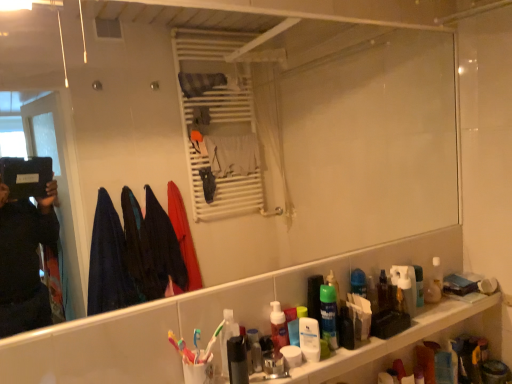
Question: Considering the relative sizes of white matte toothpaste at center and translucent plastic shelf at lower right in the image provided, is white matte toothpaste at center bigger than translucent plastic shelf at lower right?

Choices:
 (A) no
 (B) yes

Answer: (A)

Question: Is white matte toothpaste at center smaller than translucent plastic shelf at lower right?

Choices:
 (A) no
 (B) yes

Answer: (B)

Question: From a real-world perspective, is white matte toothpaste at center physically below translucent plastic shelf at lower right?

Choices:
 (A) no
 (B) yes

Answer: (A)

Question: From the image's perspective, is white matte toothpaste at center located beneath translucent plastic shelf at lower right?

Choices:
 (A) yes
 (B) no

Answer: (B)

Question: Are white matte toothpaste at center and translucent plastic shelf at lower right beside each other?

Choices:
 (A) no
 (B) yes

Answer: (A)

Question: From a real-world perspective, is translucent plastic shelf at lower right positioned above or below white matte toothpaste at center?

Choices:
 (A) above
 (B) below

Answer: (B)

Question: Visually, is translucent plastic shelf at lower right positioned to the left or to the right of white matte toothpaste at center?

Choices:
 (A) right
 (B) left

Answer: (A)

Question: Considering their positions, is translucent plastic shelf at lower right located in front of or behind white matte toothpaste at center?

Choices:
 (A) front
 (B) behind

Answer: (A)

Question: From the image's perspective, relative to white matte toothpaste at center, is translucent plastic shelf at lower right above or below?

Choices:
 (A) below
 (B) above

Answer: (A)

Question: Considering the positions of translucent plastic mouthwash at right, placed as the seventh mouthwash when sorted from left to right, and translucent plastic toothbrush at lower center, the 2th toothbrush viewed from the left, in the image, is translucent plastic mouthwash at right, placed as the seventh mouthwash when sorted from left to right, taller or shorter than translucent plastic toothbrush at lower center, the 2th toothbrush viewed from the left,?

Choices:
 (A) short
 (B) tall

Answer: (B)

Question: In the image, is translucent plastic mouthwash at right, the 1th mouthwash positioned from the right, positioned in front of or behind translucent plastic toothbrush at lower center, the first toothbrush when ordered from right to left?

Choices:
 (A) behind
 (B) front

Answer: (A)

Question: From a real-world perspective, is translucent plastic mouthwash at right, the 1th mouthwash in the back-to-front sequence, physically located above or below translucent plastic toothbrush at lower center, the 2th toothbrush viewed from the left?

Choices:
 (A) above
 (B) below

Answer: (B)

Question: Is point (429, 283) closer or farther from the camera than point (216, 334)?

Choices:
 (A) farther
 (B) closer

Answer: (A)

Question: Considering the positions of translucent plastic shelf at lower right and brown plastic bottle at lower right, the 5th mouthwash from the left, in the image, is translucent plastic shelf at lower right bigger or smaller than brown plastic bottle at lower right, the 5th mouthwash from the left,?

Choices:
 (A) big
 (B) small

Answer: (A)

Question: Is point (432, 309) positioned closer to the camera than point (386, 291)?

Choices:
 (A) farther
 (B) closer

Answer: (A)